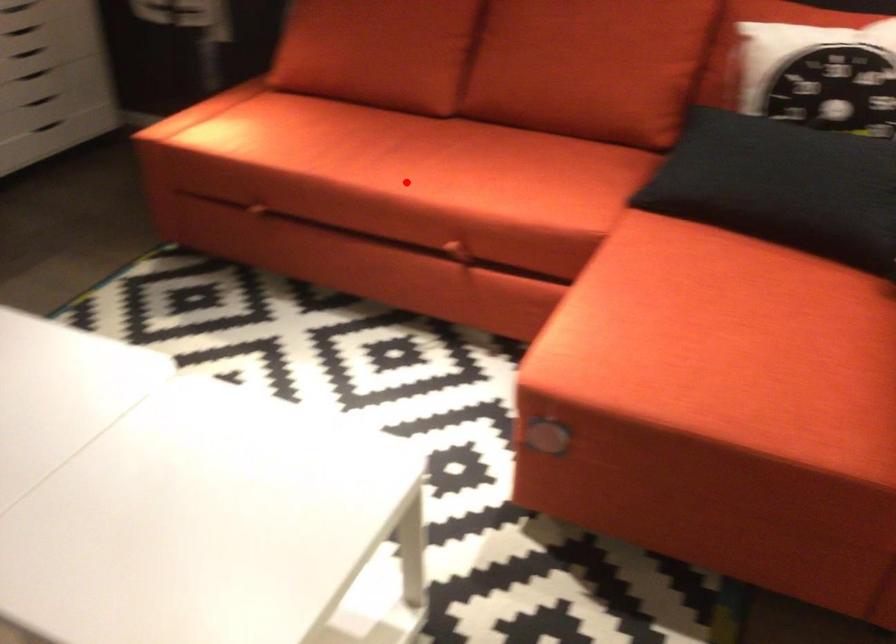
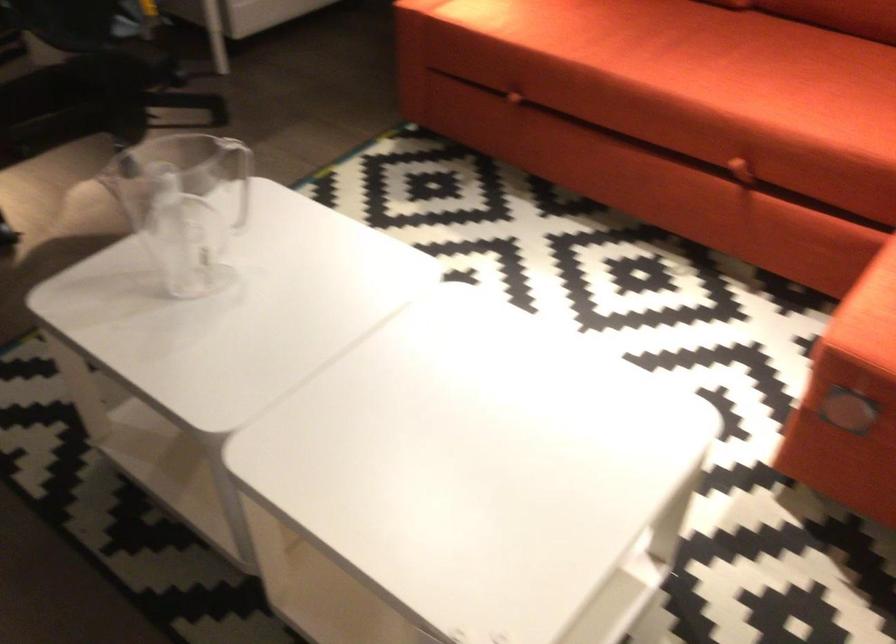
The point at the highlighted location is marked in the first image. Where is the corresponding point in the second image?

(688, 80)